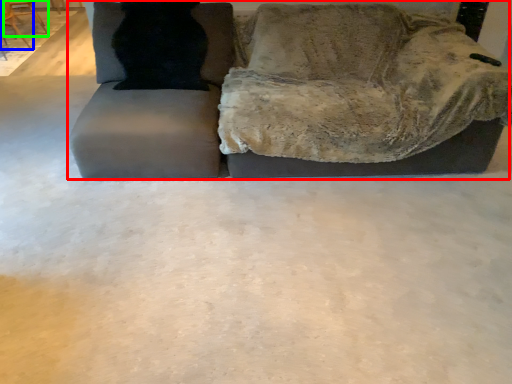
Question: Based on their relative distances, which object is nearer to studio couch (highlighted by a red box)? Choose from chair (highlighted by a blue box) and chair (highlighted by a green box).

Choices:
 (A) chair
 (B) chair

Answer: (A)